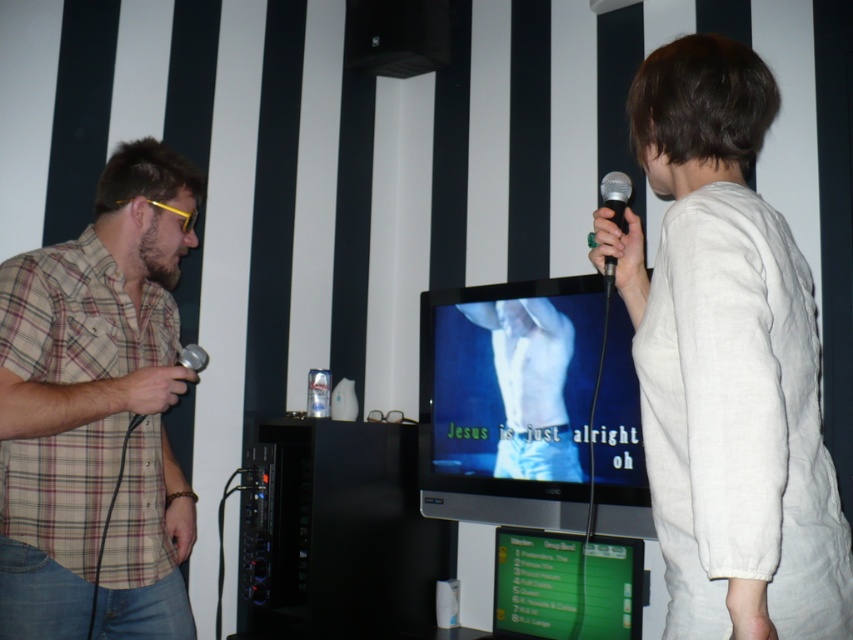
Which of these two, white matte shirt at center or black matte microphone at right, stands shorter?

black matte microphone at right is shorter.

Does white matte shirt at center lie in front of black matte microphone at right?

No, white matte shirt at center is behind black matte microphone at right.

Is point (473, 316) positioned before point (627, 182)?

No, (473, 316) is further to viewer.

This screenshot has height=640, width=853. In order to click on white matte shirt at center in this screenshot , I will do `click(531, 387)`.

Can you confirm if white cotton shirt at center is wider than plaid cotton shirt at left?

Incorrect, white cotton shirt at center's width does not surpass plaid cotton shirt at left's.

How far apart are white cotton shirt at center and plaid cotton shirt at left?

white cotton shirt at center is 1.03 meters away from plaid cotton shirt at left.

Between point (726, 353) and point (68, 406), which one is positioned in front?

Positioned in front is point (726, 353).

Find the location of `white cotton shirt at center`. white cotton shirt at center is located at coordinates (727, 362).

Image resolution: width=853 pixels, height=640 pixels. Identify the location of plaid cotton shirt at left. (97, 413).